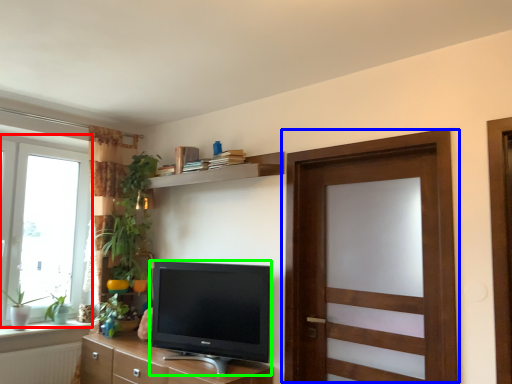
Question: Considering the real-world distances, which object is farthest from window (highlighted by a red box)? door (highlighted by a blue box) or television (highlighted by a green box)?

Choices:
 (A) door
 (B) television

Answer: (A)